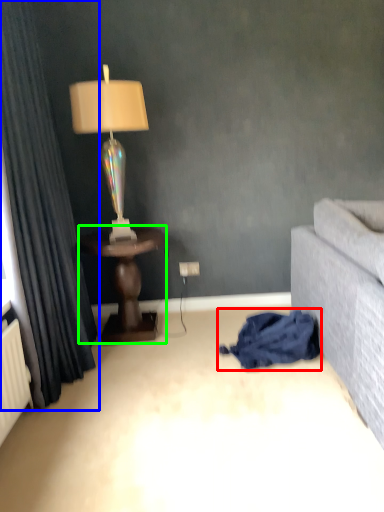
Question: Based on their relative distances, which object is farther from blanket (highlighted by a red box)? Choose from curtain (highlighted by a blue box) and table (highlighted by a green box).

Choices:
 (A) curtain
 (B) table

Answer: (A)